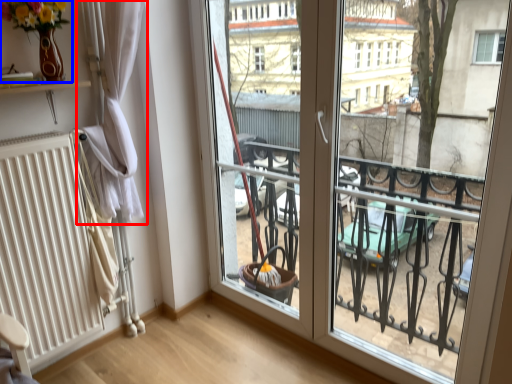
Question: Which object is closer to the camera taking this photo, curtain (highlighted by a red box) or floral arrangement (highlighted by a blue box)?

Choices:
 (A) curtain
 (B) floral arrangement

Answer: (B)